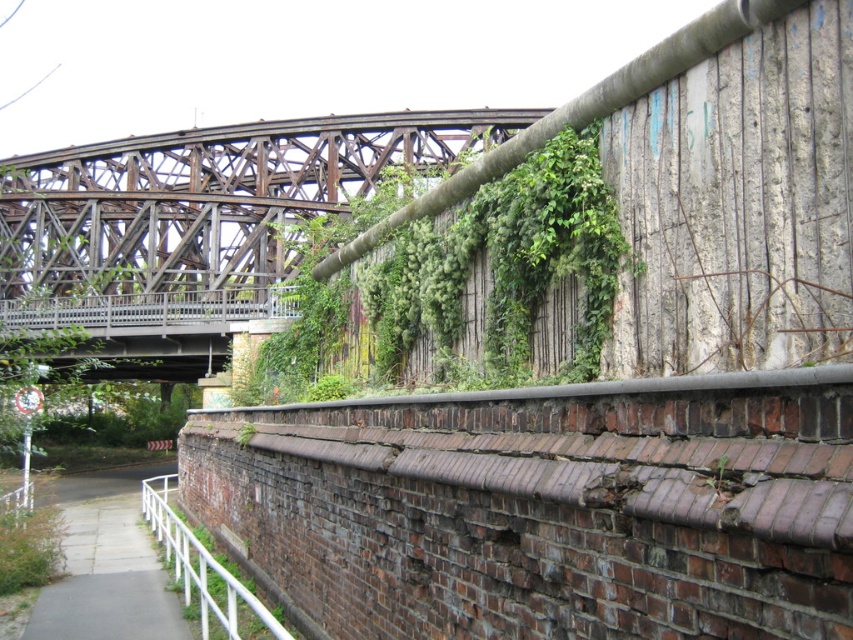
Consider the image. You are standing at the point marked by the coordinates point (x=105, y=566) in the image. Looking around, you see a gray concrete sidewalk at lower left. What is the nearest object to you?

The nearest object to you is the gray concrete sidewalk at lower left marked by the coordinates point (x=105, y=566).

You are a delivery person trying to park your bike. You see the gray concrete sidewalk at lower left and the white metal rail at lower left. Which surface can accommodate your bike if it requires a larger space?

The gray concrete sidewalk at lower left is larger in size than the white metal rail at lower left, so the bike should be parked on the gray concrete sidewalk at lower left.

You are a delivery person with a 12 feet long cart. You need to move your cart through the space between the gray concrete sidewalk at lower left and the white metal rail at lower left. Can your cart fit through that space?

The space between the gray concrete sidewalk at lower left and the white metal rail at lower left is 13.40 feet. Since your cart is 12 feet long, it can fit through the space as it is wider than the cart.